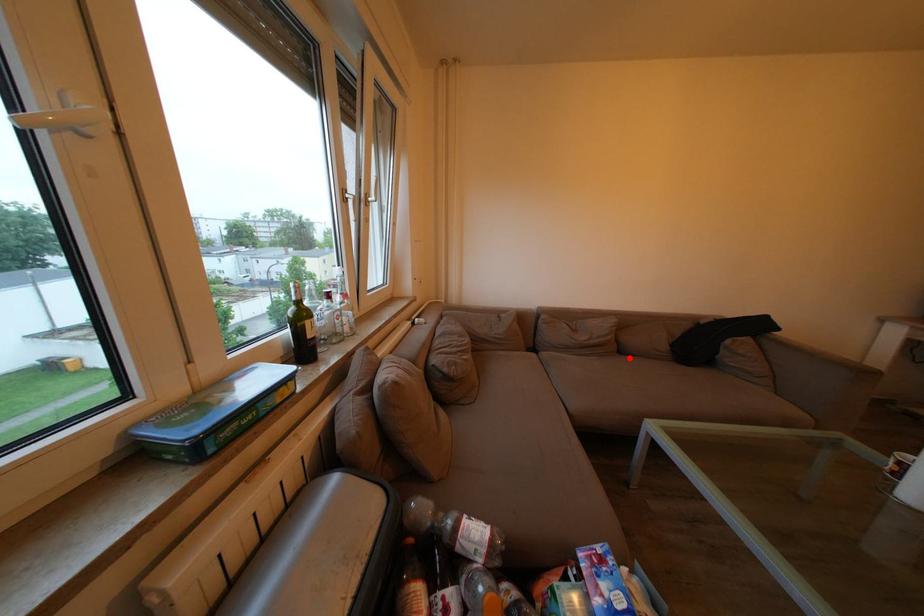
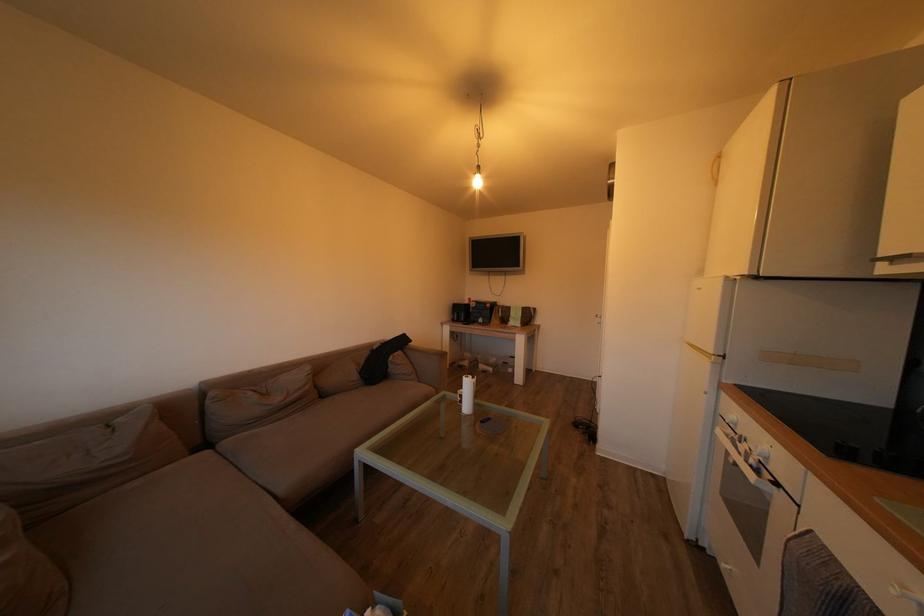
In the second image, find the point that corresponds to the highlighted location in the first image.

(331, 402)